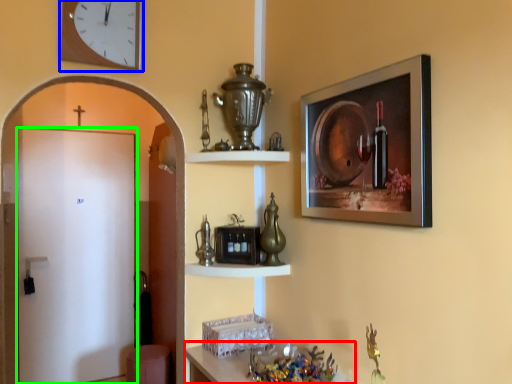
Question: Which is farther away from table (highlighted by a red box)? clock (highlighted by a blue box) or door (highlighted by a green box)?

Choices:
 (A) clock
 (B) door

Answer: (B)